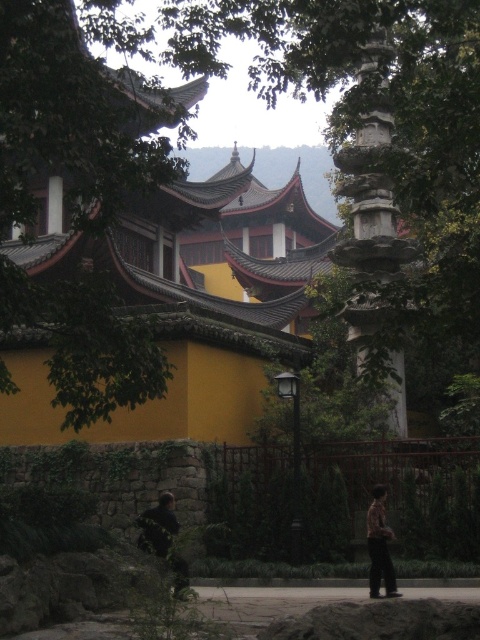
Question: Can you confirm if dark brown leather jacket at lower center is wider than brown textured shirt at lower right?

Choices:
 (A) yes
 (B) no

Answer: (A)

Question: Which object is closer to the camera taking this photo?

Choices:
 (A) brown textured shirt at lower right
 (B) dark brown leather jacket at lower center

Answer: (B)

Question: Considering the relative positions of dark brown leather jacket at lower center and brown textured shirt at lower right in the image provided, where is dark brown leather jacket at lower center located with respect to brown textured shirt at lower right?

Choices:
 (A) left
 (B) right

Answer: (A)

Question: In this image, where is dark brown leather jacket at lower center located relative to brown textured shirt at lower right?

Choices:
 (A) right
 (B) left

Answer: (B)

Question: Which object is farther from the camera taking this photo?

Choices:
 (A) dark brown leather jacket at lower center
 (B) brown textured shirt at lower right

Answer: (B)